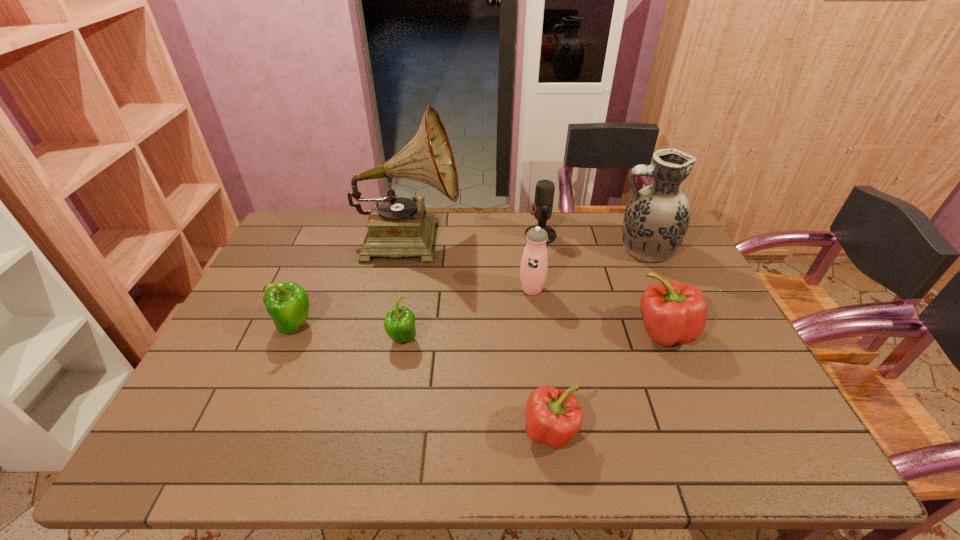
Locate an element on the screen. Image resolution: width=960 pixels, height=540 pixels. vase at the right edge is located at coordinates (656, 219).

At what (x,y) coordinates should I click in order to perform the action: click on bell pepper that is at the right edge. Please return your answer as a coordinate pair (x, y). The height and width of the screenshot is (540, 960). Looking at the image, I should click on (673, 312).

Where is `object positioned at the far right corner`? This screenshot has width=960, height=540. object positioned at the far right corner is located at coordinates (656, 219).

Locate an element on the screen. The width and height of the screenshot is (960, 540). vacant space at the far edge of the desktop is located at coordinates coord(581,247).

Locate an element on the screen. The image size is (960, 540). free space at the near edge of the desktop is located at coordinates click(277, 437).

This screenshot has height=540, width=960. What are the coordinates of `free space at the far left corner of the desktop` in the screenshot? It's located at (305, 229).

The height and width of the screenshot is (540, 960). What are the coordinates of `free space at the near right corner` in the screenshot? It's located at (726, 446).

This screenshot has height=540, width=960. Find the location of `vacant space that's between the rightmost bell pepper and the left green bell pepper`. vacant space that's between the rightmost bell pepper and the left green bell pepper is located at coordinates (479, 329).

Identify the location of free space between the smaller green bell pepper and the farther pink bell pepper. (534, 335).

At what (x,y) coordinates should I click in order to perform the action: click on vacant space in between the rightmost bell pepper and the fourth farthest object. Please return your answer as a coordinate pair (x, y). Looking at the image, I should click on (598, 310).